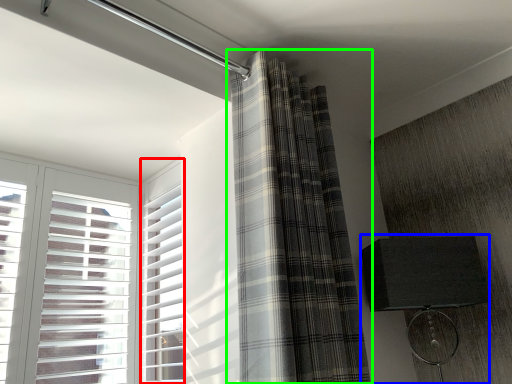
Question: Which object is the closest to the window frame (highlighted by a red box)? Choose among these: table lamp (highlighted by a blue box) or curtain (highlighted by a green box).

Choices:
 (A) table lamp
 (B) curtain

Answer: (B)